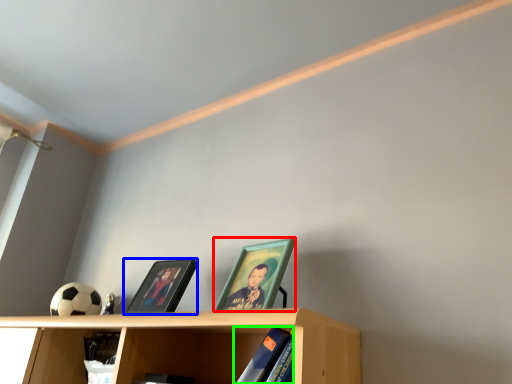
Question: Which object is the closest to the picture frame (highlighted by a red box)? Choose among these: picture frame (highlighted by a blue box) or book (highlighted by a green box).

Choices:
 (A) picture frame
 (B) book

Answer: (B)